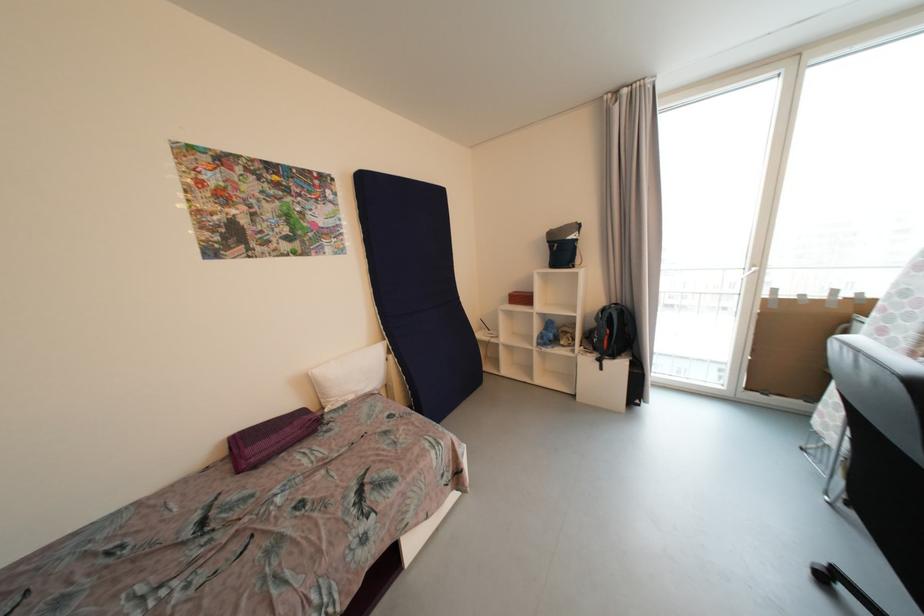
The width and height of the screenshot is (924, 616). I want to click on white door handle, so click(x=746, y=275).